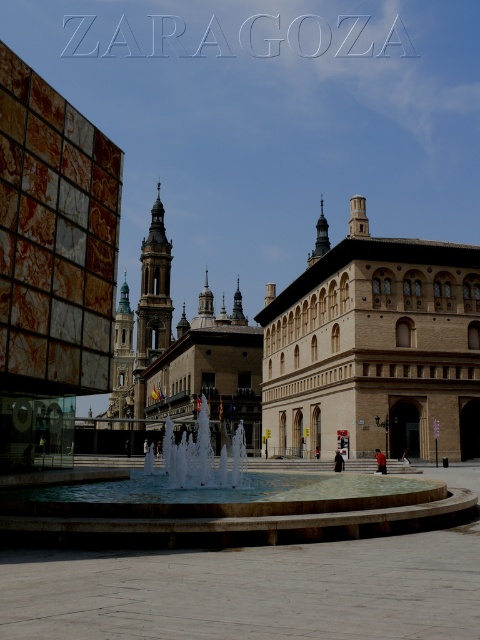
Does beige stone building at center appear on the right side of white marble fountain at center?

Indeed, beige stone building at center is positioned on the right side of white marble fountain at center.

Between beige stone building at center and white marble fountain at center, which one has more height?

beige stone building at center

Is point (268, 400) behind point (210, 474)?

Yes, point (268, 400) is behind point (210, 474).

You are a GUI agent. You are given a task and a screenshot of the screen. Output one action in this format:
    pyautogui.click(x=<x>, y=<y>)
    Task: Click on the beige stone building at center
    The image size is (480, 640).
    Given the screenshot: What is the action you would take?
    pyautogui.click(x=374, y=348)

What do you see at coordinates (374, 348) in the screenshot?
I see `beige stone building at center` at bounding box center [374, 348].

Can you confirm if beige stone building at center is bigger than white glossy fountain at center?

Correct, beige stone building at center is larger in size than white glossy fountain at center.

The image size is (480, 640). Describe the element at coordinates (374, 348) in the screenshot. I see `beige stone building at center` at that location.

The image size is (480, 640). What are the coordinates of `beige stone building at center` in the screenshot? It's located at (374, 348).

Between white marble fountain at center and white glossy fountain at center, which one appears on the right side from the viewer's perspective?

Positioned to the right is white marble fountain at center.

Looking at this image, between white marble fountain at center and white glossy fountain at center, which one is positioned lower?

white marble fountain at center is lower down.

Who is more forward, (75, 492) or (204, 464)?

Point (75, 492)

This screenshot has width=480, height=640. I want to click on white marble fountain at center, so click(218, 504).